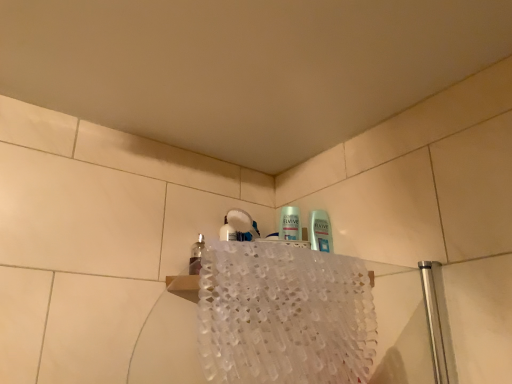
Question: Is white lace bath towel at upper center outside transparent glass mouthwash at upper left?

Choices:
 (A) yes
 (B) no

Answer: (A)

Question: Is transparent glass mouthwash at upper left at the back of white lace bath towel at upper center?

Choices:
 (A) yes
 (B) no

Answer: (A)

Question: Considering the relative positions of white lace bath towel at upper center and transparent glass mouthwash at upper left in the image provided, is white lace bath towel at upper center to the left of transparent glass mouthwash at upper left from the viewer's perspective?

Choices:
 (A) no
 (B) yes

Answer: (A)

Question: From a real-world perspective, is white lace bath towel at upper center on transparent glass mouthwash at upper left?

Choices:
 (A) yes
 (B) no

Answer: (B)

Question: Does white lace bath towel at upper center touch transparent glass mouthwash at upper left?

Choices:
 (A) no
 (B) yes

Answer: (A)

Question: Is white lace bath towel at upper center closer to the viewer compared to transparent glass mouthwash at upper left?

Choices:
 (A) no
 (B) yes

Answer: (B)

Question: Is transparent glass mouthwash at upper left positioned before white lace bath towel at upper center?

Choices:
 (A) yes
 (B) no

Answer: (B)

Question: Can you confirm if transparent glass mouthwash at upper left is bigger than white lace bath towel at upper center?

Choices:
 (A) no
 (B) yes

Answer: (A)

Question: Is transparent glass mouthwash at upper left oriented towards white lace bath towel at upper center?

Choices:
 (A) yes
 (B) no

Answer: (B)

Question: Is transparent glass mouthwash at upper left at the left side of white lace bath towel at upper center?

Choices:
 (A) no
 (B) yes

Answer: (B)

Question: Does transparent glass mouthwash at upper left have a lesser height compared to white lace bath towel at upper center?

Choices:
 (A) no
 (B) yes

Answer: (B)

Question: Is transparent glass mouthwash at upper left positioned far away from white lace bath towel at upper center?

Choices:
 (A) no
 (B) yes

Answer: (A)

Question: Looking at the image, does transparent glass mouthwash at upper left seem bigger or smaller compared to white lace bath towel at upper center?

Choices:
 (A) big
 (B) small

Answer: (B)